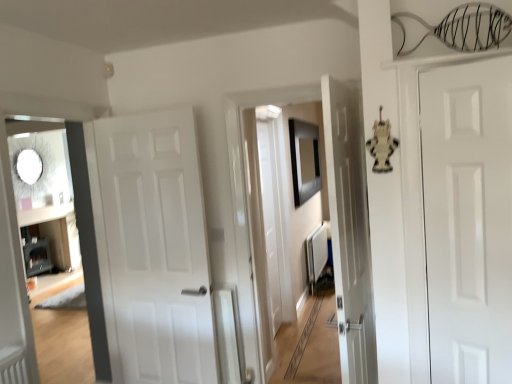
Question: From a real-world perspective, is matte white door at left physically located above or below black matte picture frame at center?

Choices:
 (A) below
 (B) above

Answer: (A)

Question: In the image, is matte white door at left positioned in front of or behind black matte picture frame at center?

Choices:
 (A) behind
 (B) front

Answer: (B)

Question: Estimate the real-world distances between objects in this image. Which object is farther from the white matte radiator at center?

Choices:
 (A) black matte picture frame at center
 (B) white glossy door at right, which is counted as the first door, starting from the right
 (C) matte white door at left
 (D) white matte door at center, which is the 2th door in front-to-back order

Answer: (C)

Question: Which is farther from the white matte door at center, which is the 2th door in front-to-back order?

Choices:
 (A) matte white door at left
 (B) white glossy door at right, which is counted as the first door, starting from the right
 (C) white matte radiator at center
 (D) black matte picture frame at center

Answer: (C)